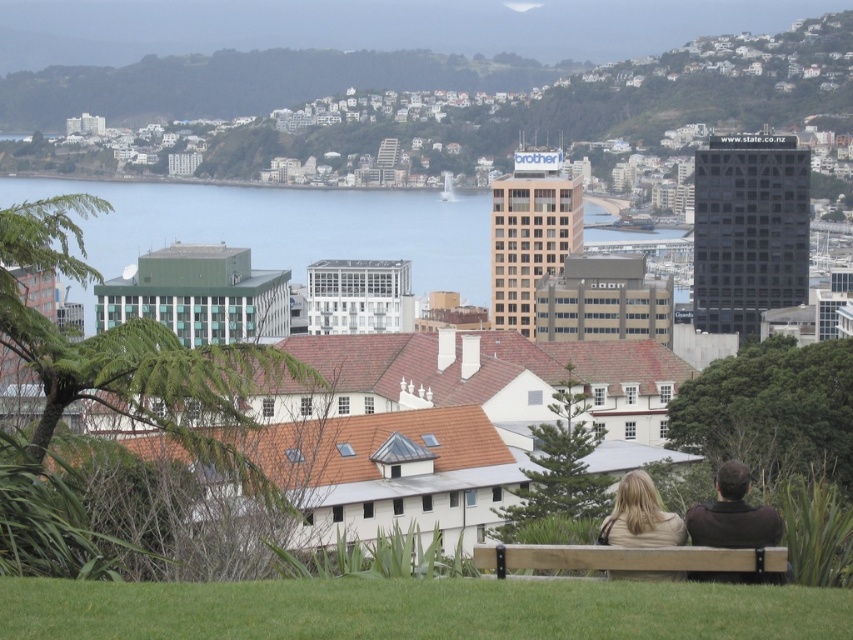
Based on the photo, you are standing at the viewpoint and want to take a photo of the clear blue water at center and the light brown leather jacket at lower center. To ensure both are in the frame, should you adjust your camera to the left or right?

The clear blue water at center is to the left of the light brown leather jacket at lower center, so you should adjust your camera to the left to include both in the frame.

You are planning to sit on one of the benches in the image. The brown wooden bench at lower center and the light brown leather bench at lower center are both available. According to the scene, which bench is located to the left when viewed from your perspective?

The brown wooden bench at lower center is positioned on the left side of the light brown leather bench at lower center, so it is the one on the left.

You are a photographer trying to capture both the brown wooden bench at lower center and the light brown leather bench at lower center in the same frame. Since you want to include both benches clearly, which bench should you focus on to ensure both are in focus?

You should focus on the brown wooden bench at lower center because it is closer to the viewer than the light brown leather bench at lower center, and focusing on the closer object will keep both in focus when using a narrow aperture or sufficient depth of field.